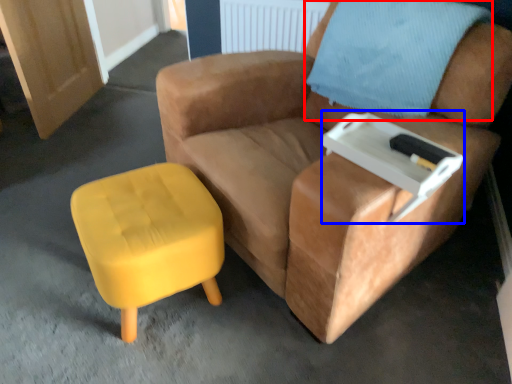
Question: Which of the following is the farthest to the observer, pillow (highlighted by a red box) or side table (highlighted by a blue box)?

Choices:
 (A) pillow
 (B) side table

Answer: (A)